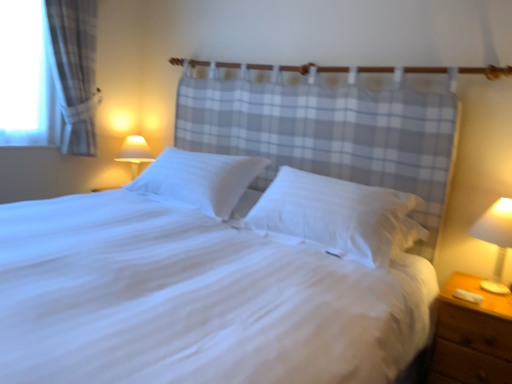
Question: Which direction should I rotate to face white smooth pillow at center, acting as the second pillow starting from the right, — up or down?

Choices:
 (A) down
 (B) up

Answer: (B)

Question: Does white soft pillow at center, which is the second pillow in left-to-right order, have a larger size compared to white smooth bed at center?

Choices:
 (A) no
 (B) yes

Answer: (A)

Question: Does white soft pillow at center, which appears as the 1th pillow when viewed from the right, have a lesser width compared to white smooth bed at center?

Choices:
 (A) no
 (B) yes

Answer: (B)

Question: From the image's perspective, does white soft pillow at center, which appears as the 1th pillow when viewed from the right, appear higher than white smooth bed at center?

Choices:
 (A) yes
 (B) no

Answer: (A)

Question: Is white soft pillow at center, which is the second pillow in left-to-right order, to the left of white smooth bed at center from the viewer's perspective?

Choices:
 (A) yes
 (B) no

Answer: (B)

Question: Considering the relative sizes of white soft pillow at center, which appears as the 1th pillow when viewed from the right, and white smooth bed at center in the image provided, is white soft pillow at center, which appears as the 1th pillow when viewed from the right, smaller than white smooth bed at center?

Choices:
 (A) yes
 (B) no

Answer: (A)

Question: From a real-world perspective, is white soft pillow at center, which appears as the 1th pillow when viewed from the right, located higher than white smooth bed at center?

Choices:
 (A) no
 (B) yes

Answer: (B)

Question: From a real-world perspective, does white plastic lamp at right sit lower than brown wooden nightstand at lower right?

Choices:
 (A) no
 (B) yes

Answer: (A)

Question: Is brown wooden nightstand at lower right surrounded by white plastic lamp at right?

Choices:
 (A) yes
 (B) no

Answer: (B)

Question: Is white plastic lamp at right oriented towards brown wooden nightstand at lower right?

Choices:
 (A) yes
 (B) no

Answer: (B)

Question: From a real-world perspective, is white plastic lamp at right on top of brown wooden nightstand at lower right?

Choices:
 (A) yes
 (B) no

Answer: (A)

Question: Is white plastic lamp at right positioned far away from brown wooden nightstand at lower right?

Choices:
 (A) yes
 (B) no

Answer: (B)

Question: Is white plastic lamp at right closer to the viewer compared to brown wooden nightstand at lower right?

Choices:
 (A) no
 (B) yes

Answer: (A)

Question: From a real-world perspective, does white soft pillow at center, which appears as the 1th pillow when viewed from the right, stand above white plastic lamp at right?

Choices:
 (A) no
 (B) yes

Answer: (B)